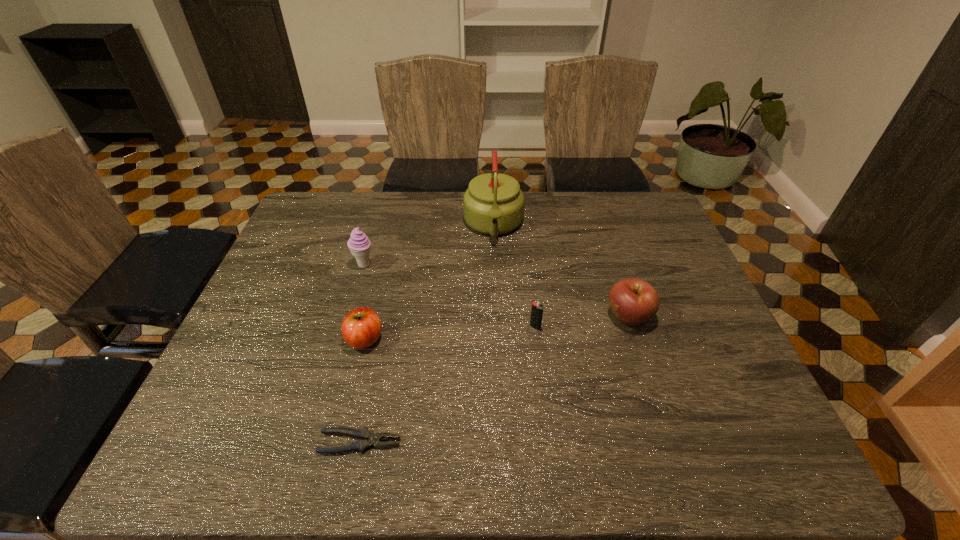
Identify the location of the tallest object. (493, 204).

You are a GUI agent. You are given a task and a screenshot of the screen. Output one action in this format:
    pyautogui.click(x=<x>, y=<y>)
    Task: Click on the farthest object
    Image resolution: width=960 pixels, height=540 pixels.
    Given the screenshot: What is the action you would take?
    pyautogui.click(x=493, y=204)

In order to click on icecream in this screenshot , I will do (x=359, y=244).

Identify the location of the second farthest object. (359, 244).

Where is `the right apple`? the right apple is located at coordinates (633, 301).

The width and height of the screenshot is (960, 540). Find the location of `the left apple`. the left apple is located at coordinates (361, 327).

Find the location of a particular element. This screenshot has width=960, height=540. igniter is located at coordinates (537, 308).

Find the location of a particular element. the nearest object is located at coordinates (368, 439).

The width and height of the screenshot is (960, 540). I want to click on pliers, so click(368, 439).

Identify the location of free region located at the spout of the kettle. (496, 298).